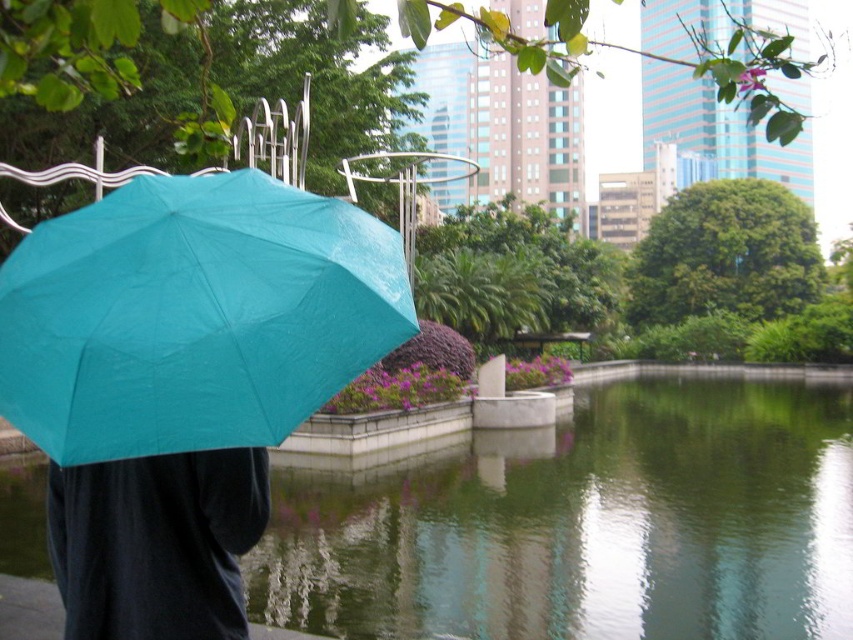
Is teal matte umbrella at left bigger than matte black pants at lower left?

Correct, teal matte umbrella at left is larger in size than matte black pants at lower left.

Between point (146, 326) and point (186, 493), which one is positioned behind?

Positioned behind is point (186, 493).

Where is `teal matte umbrella at left`? This screenshot has width=853, height=640. teal matte umbrella at left is located at coordinates (193, 316).

Can you confirm if green reflective water at center is thinner than teal matte umbrella at left?

Incorrect, green reflective water at center's width is not less than teal matte umbrella at left's.

In the scene shown: Which of these two, green reflective water at center or teal matte umbrella at left, stands shorter?

green reflective water at center

Measure the distance between point (566, 496) and camera.

The distance of point (566, 496) from camera is 11.52 meters.

This screenshot has height=640, width=853. Find the location of `green reflective water at center`. green reflective water at center is located at coordinates 585,524.

Who is positioned more to the left, green reflective water at center or matte black pants at lower left?

From the viewer's perspective, matte black pants at lower left appears more on the left side.

Does point (439, 566) lie in front of point (136, 464)?

No, it is behind (136, 464).

Which is in front, point (544, 637) or point (195, 605)?

Point (195, 605) is more forward.

This screenshot has width=853, height=640. I want to click on green reflective water at center, so click(x=585, y=524).